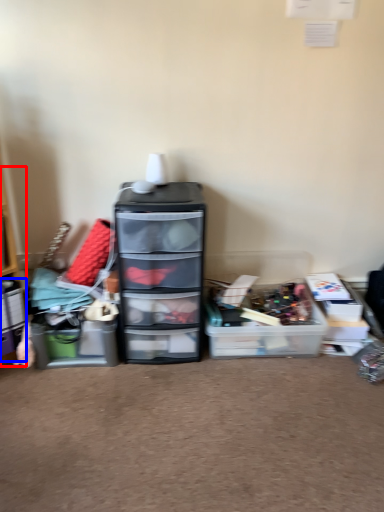
Question: Which of the following is the farthest to the observer, shelf (highlighted by a red box) or storage box (highlighted by a blue box)?

Choices:
 (A) shelf
 (B) storage box

Answer: (B)